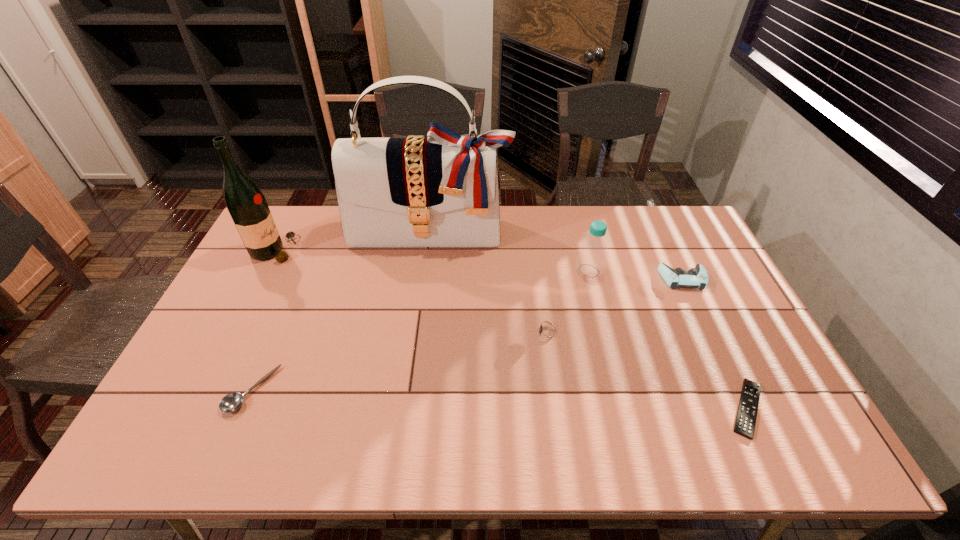
Find the location of a particular element. This screenshot has width=960, height=540. empty location between the fifth object from left to right and the fifth object from right to left is located at coordinates (510, 252).

Locate an element on the screen. Image resolution: width=960 pixels, height=540 pixels. free space between the control and the second tallest object is located at coordinates (479, 265).

Identify which object is the fourth nearest to the second shortest object. Please provide its 2D coordinates. Your answer should be formatted as a tuple, i.e. [(x, y)], where the tuple contains the x and y coordinates of a point satisfying the conditions above.

[(592, 255)]

Locate which object ranks second in proximity to the fourth tallest object. Please provide its 2D coordinates. Your answer should be formatted as a tuple, i.e. [(x, y)], where the tuple contains the x and y coordinates of a point satisfying the conditions above.

[(745, 421)]

Where is `vacant point that satisfies the following two spatial constraints: 1. on the surface of the fifth object from left to right; 2. on the left side of the sixth shortest object`? This screenshot has width=960, height=540. vacant point that satisfies the following two spatial constraints: 1. on the surface of the fifth object from left to right; 2. on the left side of the sixth shortest object is located at coordinates (264, 271).

At what (x,y) coordinates should I click in order to perform the action: click on vacant point that satisfies the following two spatial constraints: 1. on the back side of the fourth tallest object; 2. on the right side of the ladle. Please return your answer as a coordinate pair (x, y). Looking at the image, I should click on (299, 279).

The width and height of the screenshot is (960, 540). I want to click on vacant space that satisfies the following two spatial constraints: 1. on the surface of the sixth tallest object; 2. on the right side of the wine bottle, so click(204, 390).

This screenshot has width=960, height=540. What are the coordinates of `vacant space that satisfies the following two spatial constraints: 1. on the surface of the wine bottle; 2. on the right side of the control` in the screenshot? It's located at (260, 279).